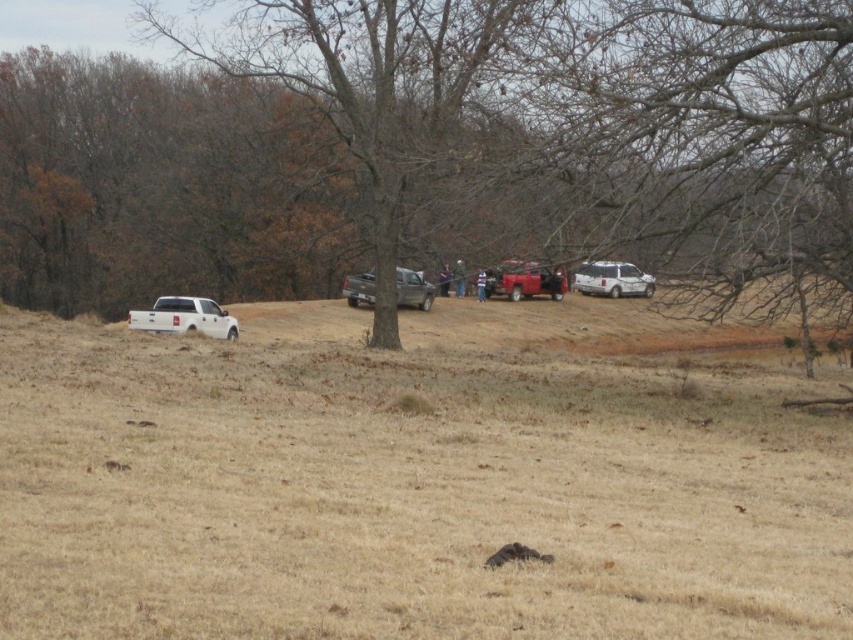
Which is above, brown grassy field at lower center or metallic red truck at center?

Positioned higher is metallic red truck at center.

Who is positioned more to the left, brown grassy field at lower center or metallic red truck at center?

From the viewer's perspective, brown grassy field at lower center appears more on the left side.

Identify the location of brown grassy field at lower center. The image size is (853, 640). (419, 477).

Who is positioned more to the left, metallic red truck at center or white matte suv at center-right?

From the viewer's perspective, metallic red truck at center appears more on the left side.

Between point (561, 272) and point (616, 266), which one is positioned in front?

Point (561, 272)

The image size is (853, 640). I want to click on metallic red truck at center, so click(x=525, y=280).

Is white matte suv at center-right below metallic gray truck at center?

No.

Is white matte suv at center-right thinner than metallic gray truck at center?

No, white matte suv at center-right is not thinner than metallic gray truck at center.

The image size is (853, 640). What do you see at coordinates (612, 280) in the screenshot? I see `white matte suv at center-right` at bounding box center [612, 280].

The height and width of the screenshot is (640, 853). I want to click on white matte suv at center-right, so click(x=612, y=280).